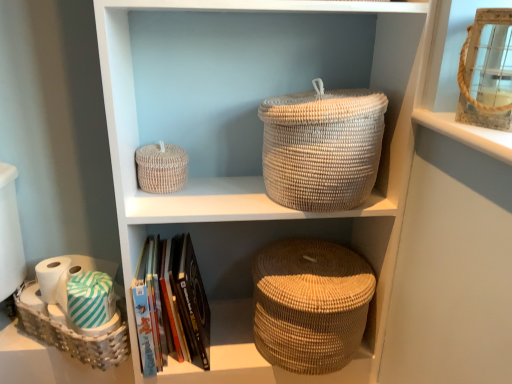
Question: From a real-world perspective, is woven beige basket at upper left, acting as the 2th basket starting from the right, over white matte toilet paper at lower left, the second toilet paper from the right?

Choices:
 (A) no
 (B) yes

Answer: (B)

Question: Could you tell me if woven beige basket at upper left, acting as the 2th basket starting from the right, is turned towards white matte toilet paper at lower left, the second toilet paper from the right?

Choices:
 (A) yes
 (B) no

Answer: (B)

Question: Is woven beige basket at upper left, acting as the 2th basket starting from the right, positioned beyond the bounds of white matte toilet paper at lower left, the second toilet paper from the right?

Choices:
 (A) yes
 (B) no

Answer: (A)

Question: From a real-world perspective, is woven beige basket at upper left, the 2th basket positioned from the left, located beneath white matte toilet paper at lower left, which ranks as the 1th toilet paper in left-to-right order?

Choices:
 (A) no
 (B) yes

Answer: (A)

Question: Considering the relative sizes of woven beige basket at upper left, acting as the second basket starting from the top, and white matte toilet paper at lower left, the second toilet paper from the right, in the image provided, is woven beige basket at upper left, acting as the second basket starting from the top, taller than white matte toilet paper at lower left, the second toilet paper from the right,?

Choices:
 (A) no
 (B) yes

Answer: (B)

Question: Considering the relative sizes of woven beige basket at upper left, acting as the second basket starting from the top, and white matte toilet paper at lower left, which ranks as the 1th toilet paper in left-to-right order, in the image provided, is woven beige basket at upper left, acting as the second basket starting from the top, thinner than white matte toilet paper at lower left, which ranks as the 1th toilet paper in left-to-right order,?

Choices:
 (A) no
 (B) yes

Answer: (A)

Question: Is white matte toilet paper at lower left, which ranks as the 1th toilet paper in left-to-right order, not within white woven basket at lower left, placed as the 3th basket when sorted from right to left?

Choices:
 (A) yes
 (B) no

Answer: (A)

Question: Considering the relative sizes of white matte toilet paper at lower left, which ranks as the 1th toilet paper in left-to-right order, and white woven basket at lower left, acting as the 1th basket starting from the left, in the image provided, is white matte toilet paper at lower left, which ranks as the 1th toilet paper in left-to-right order, smaller than white woven basket at lower left, acting as the 1th basket starting from the left,?

Choices:
 (A) no
 (B) yes

Answer: (B)

Question: Is the depth of white matte toilet paper at lower left, which ranks as the 1th toilet paper in left-to-right order, greater than that of white woven basket at lower left, placed as the 3th basket when sorted from right to left?

Choices:
 (A) yes
 (B) no

Answer: (A)

Question: Does white matte toilet paper at lower left, which ranks as the 1th toilet paper in left-to-right order, lie in front of white woven basket at lower left, acting as the third basket starting from the top?

Choices:
 (A) no
 (B) yes

Answer: (A)

Question: Is white matte toilet paper at lower left, which ranks as the 1th toilet paper in left-to-right order, to the left of white woven basket at lower left, acting as the 1th basket starting from the left, from the viewer's perspective?

Choices:
 (A) yes
 (B) no

Answer: (A)

Question: Is white matte toilet paper at lower left, the second toilet paper from the right, taller than white woven basket at lower left, acting as the third basket starting from the top?

Choices:
 (A) no
 (B) yes

Answer: (A)

Question: Is natural woven basket at center smaller than woven beige basket at upper left, acting as the second basket starting from the top?

Choices:
 (A) yes
 (B) no

Answer: (B)